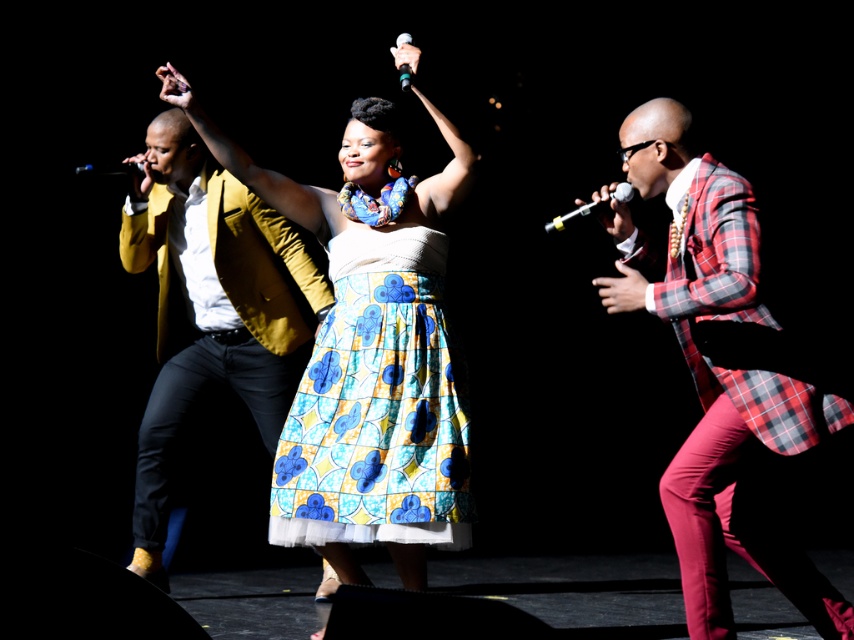
Question: Which point is farther to the camera?

Choices:
 (A) (143, 186)
 (B) (246, 387)

Answer: (B)

Question: Can you confirm if metallic silver microphone at right is bigger than matte yellow jacket at left?

Choices:
 (A) no
 (B) yes

Answer: (B)

Question: Can you confirm if plaid fabric suit at right is positioned to the right of metallic silver microphone at upper center?

Choices:
 (A) yes
 (B) no

Answer: (A)

Question: Observing the image, what is the correct spatial positioning of matte yellow blazer at left in reference to metallic silver microphone at upper center?

Choices:
 (A) above
 (B) below

Answer: (B)

Question: Considering the real-world distances, which object is closest to the blue and yellow printed fabric skirt at center?

Choices:
 (A) matte yellow blazer at left
 (B) metallic silver microphone at upper center

Answer: (A)

Question: Which of the following is the farthest from the observer?

Choices:
 (A) (398, 67)
 (B) (591, 205)
 (C) (747, 445)
 (D) (407, 362)

Answer: (D)